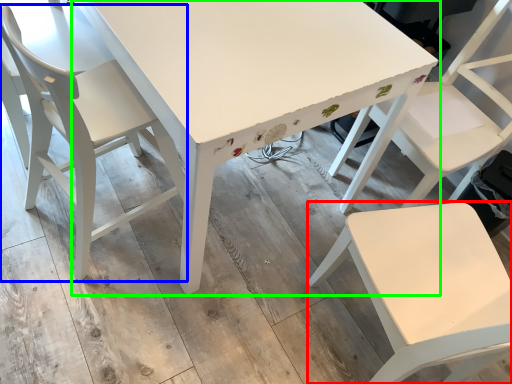
Question: Which is farther away from chair (highlighted by a red box)? chair (highlighted by a blue box) or table (highlighted by a green box)?

Choices:
 (A) chair
 (B) table

Answer: (A)